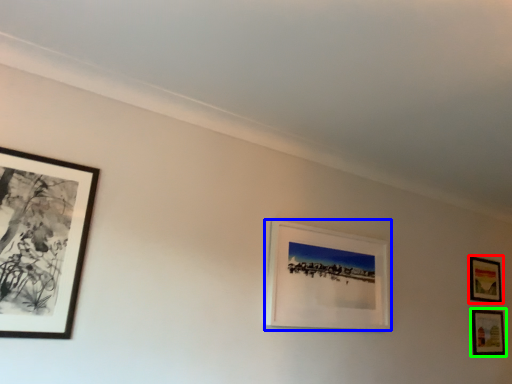
Question: Considering the real-world distances, which object is farthest from picture frame (highlighted by a red box)? picture frame (highlighted by a blue box) or picture frame (highlighted by a green box)?

Choices:
 (A) picture frame
 (B) picture frame

Answer: (A)